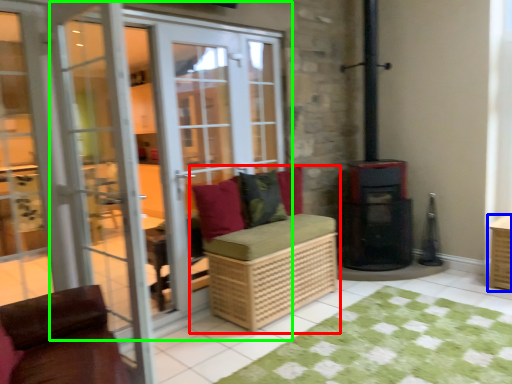
Question: Which object is positioned farthest from furniture (highlighted by a red box)? Select from crate (highlighted by a blue box) and door (highlighted by a green box).

Choices:
 (A) crate
 (B) door

Answer: (A)